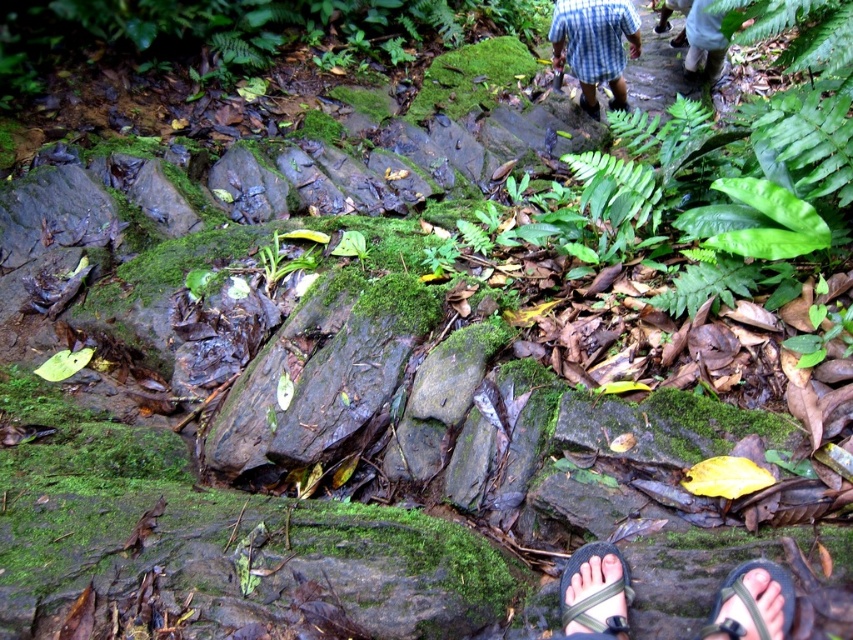
You are a hiker looking at the forest path. You see a blue plaid shirt at upper center and a black fabric sandal at lower right. Which object is larger in size?

The blue plaid shirt at upper center is bigger than the black fabric sandal at lower right.